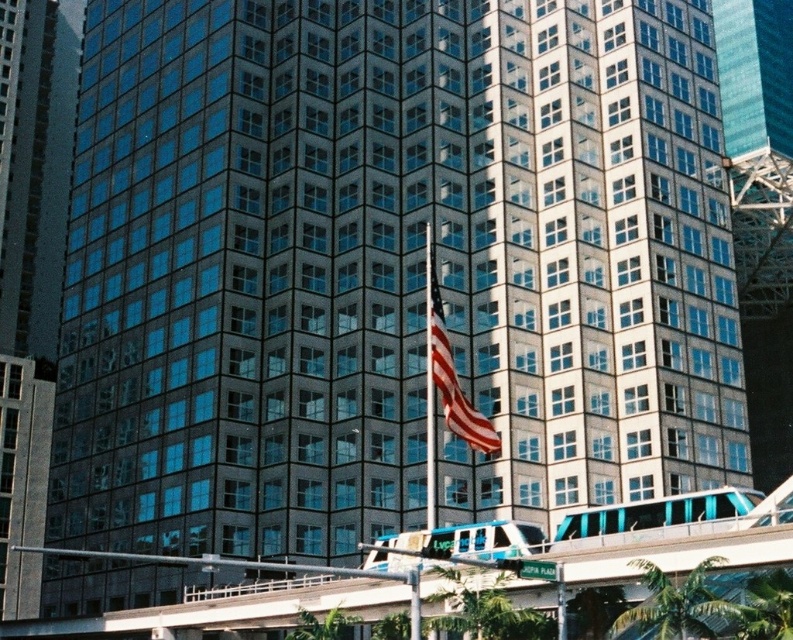
You are a city planner assessing the space between the green leafy palm tree at lower right and the teal glossy train at center. Can you determine if the palm tree is narrower than the train?

The green leafy palm tree at lower right is narrower than the teal glossy train at center, so yes, the palm tree is narrower than the train.

You are standing at the entrance of the building and want to take a photo of the teal glossy train at center without the green leafy palm tree at lower right blocking the view. Is the palm tree currently in front of the train, making it difficult to capture a clear shot?

The green leafy palm tree at lower right is in front of the teal glossy train at center, so it will block the view of the train. Move to a position where the palm tree is no longer between you and the train to get a clear shot.

You are standing in front of the tall building and want to plant a new palm tree. The current green leafy palm tree at lower right is blocking the view of the american flag at center. Can you move the palm tree to the left side without obstructing the flag?

The green leafy palm tree at lower right is positioned under the american flag at center, so moving it to the left side would not obstruct the flag as it is currently under it. However, ensure the new position does not block the flag.